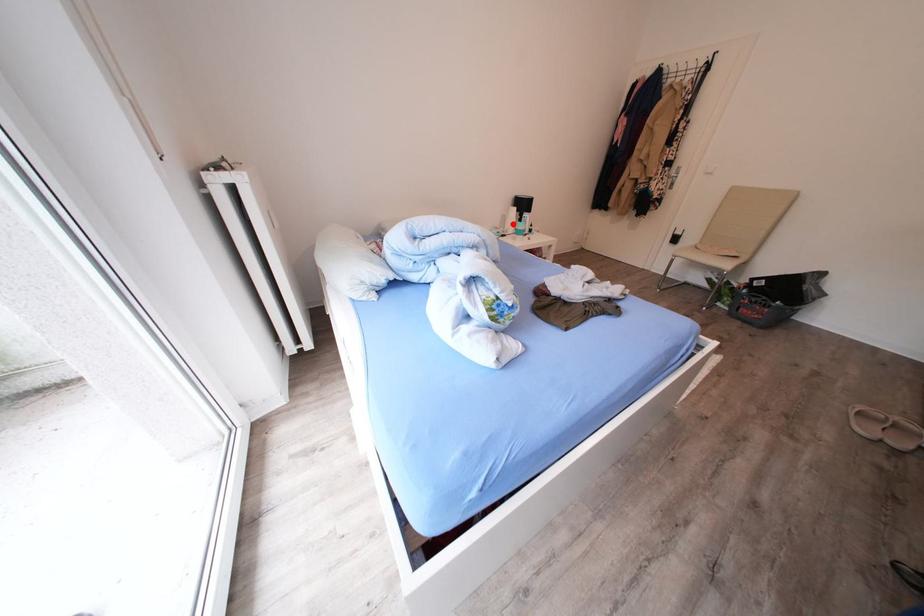
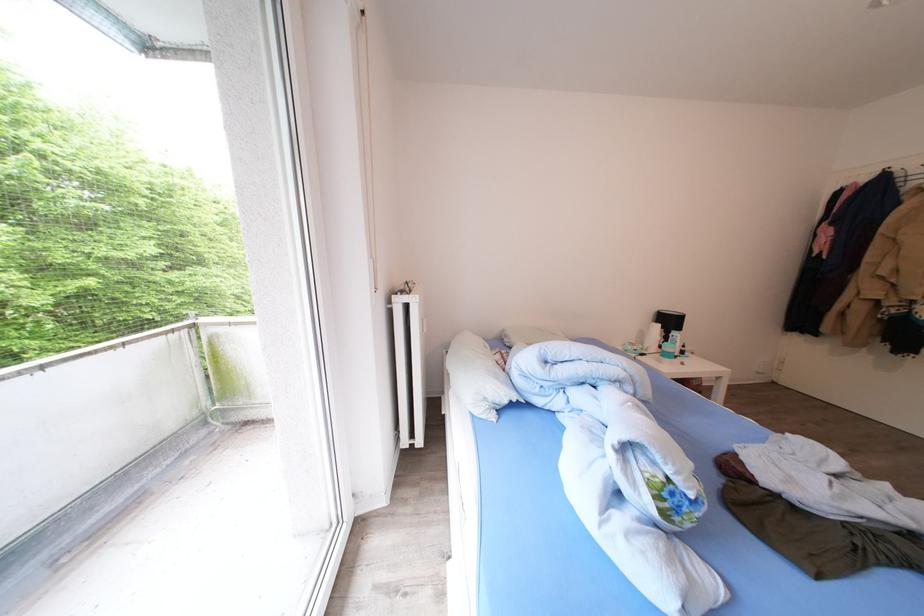
Question: I am providing you with two images of the same scene from different viewpoints. Image1 has a red point marked. In image2, the corresponding 3D location appears at what relative position? Reply with the corresponding letter.

Choices:
 (A) Closer
 (B) Farther

Answer: (A)